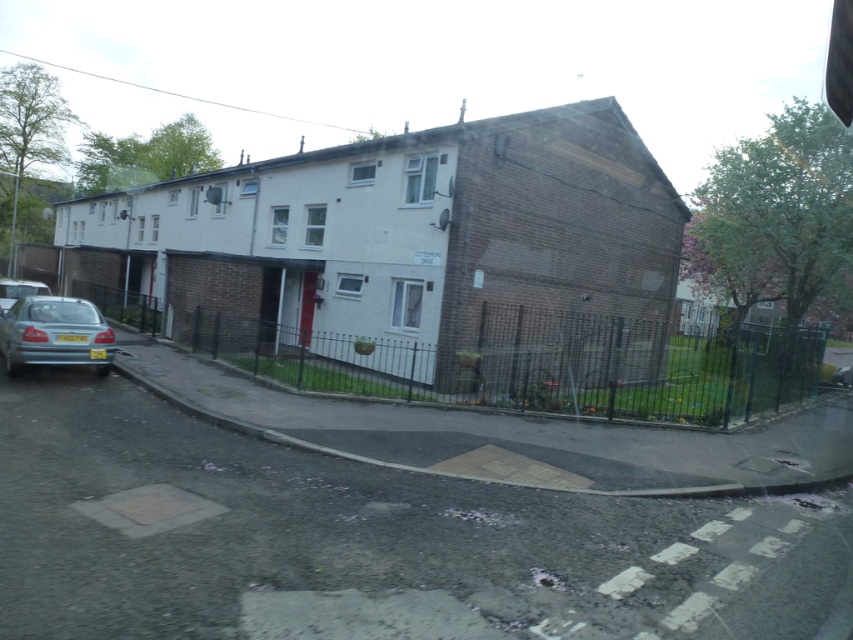
You are a delivery person trying to park your van between the silver metallic car at lower left and the metallic silver car at left. Can you fit your van which is 2 meters wide between them?

The silver metallic car at lower left is thinner than the metallic silver car at left, but the exact distance between them isn not provided. Without knowing the space between the two cars, it is impossible to determine if the van can fit.

You are standing in front of the building and notice two points marked on the ground. The first point is at coordinate point [18,332] and the second is at point [4,284]. Which point is closer to your current position?

Point [18,332] is closer to the camera than point [4,284], so the first point is closer to your current position.

You are standing in front of the building and want to park your car. There are two cars present, a silver metallic car at lower left and a metallic silver car at left. Which car is parked closer to you?

Result: The silver metallic car at lower left is closer to the viewer than the metallic silver car at left, so the silver metallic car at lower left is parked closer to you.